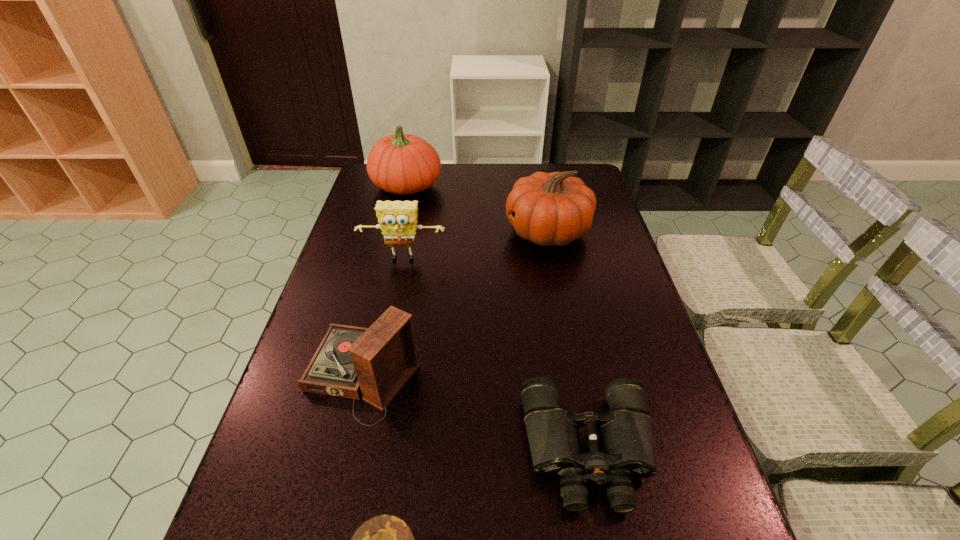
In the image, there is a desktop. Identify the location of free space at the right edge. (688, 464).

The image size is (960, 540). What are the coordinates of `vacant region at the far right corner of the desktop` in the screenshot? It's located at (577, 168).

At what (x,y) coordinates should I click in order to perform the action: click on vacant space that's between the left pumpkin and the phonograph record. Please return your answer as a coordinate pair (x, y). The image size is (960, 540). Looking at the image, I should click on (385, 281).

What are the coordinates of `unoccupied position between the farther pumpkin and the phonograph record` in the screenshot? It's located at (385, 281).

At what (x,y) coordinates should I click in order to perform the action: click on empty space that is in between the farther pumpkin and the right pumpkin. Please return your answer as a coordinate pair (x, y). Looking at the image, I should click on (477, 209).

This screenshot has height=540, width=960. Identify the location of vacant space that is in between the right pumpkin and the phonograph record. (455, 303).

Locate an element on the screen. vacant space in between the shortest object and the sponge is located at coordinates (495, 355).

Where is `object that ranks as the fourth closest to the shortest object`? The image size is (960, 540). object that ranks as the fourth closest to the shortest object is located at coordinates (549, 209).

Identify the location of object that stands as the fifth closest to the shortest object. (404, 164).

Find the location of `vacant position in the image that satisfies the following two spatial constraints: 1. on the face of the nearer pumpkin; 2. on the face of the sponge`. vacant position in the image that satisfies the following two spatial constraints: 1. on the face of the nearer pumpkin; 2. on the face of the sponge is located at coordinates (553, 259).